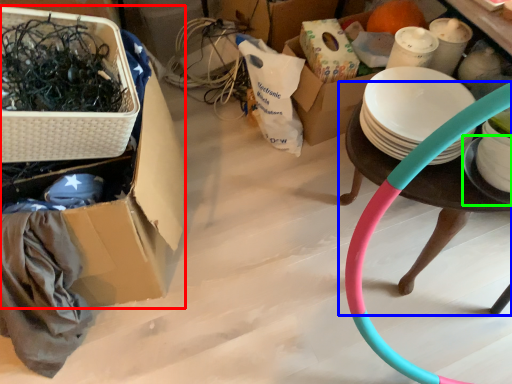
Question: Which object is the closest to the box (highlighted by a red box)? Choose among these: table (highlighted by a blue box) or plate (highlighted by a green box).

Choices:
 (A) table
 (B) plate

Answer: (A)